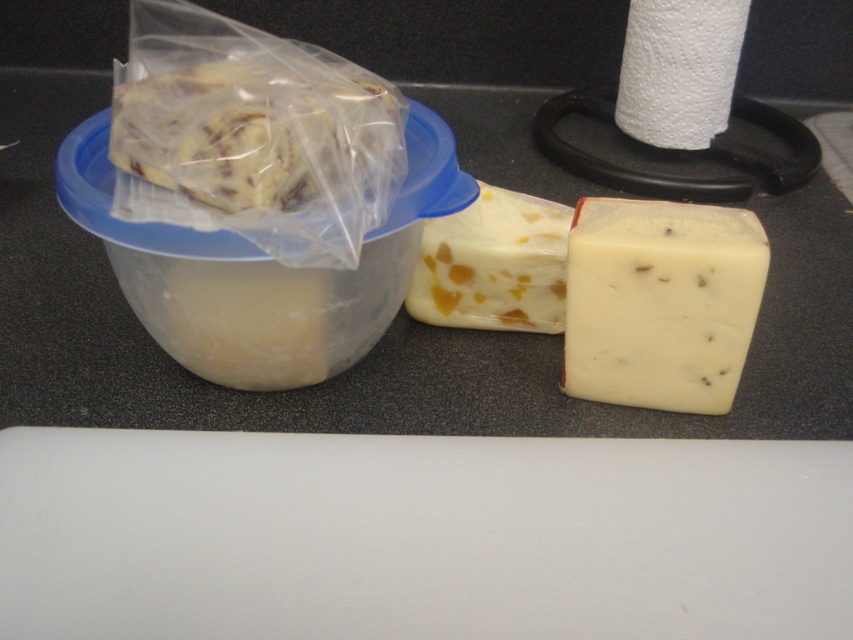
Where is `yellow crumbly cheese at center`? yellow crumbly cheese at center is located at coordinates (492, 264).

Is yellow crumbly cheese at center taller than white textured paper towel at upper right?

No.

Does point (426, 230) come behind point (717, 22)?

No, (426, 230) is closer to viewer.

The height and width of the screenshot is (640, 853). I want to click on yellow crumbly cheese at center, so click(492, 264).

Between translucent plastic bagged food at left and white textured paper towel at upper right, which one has more height?

white textured paper towel at upper right

Does translucent plastic bagged food at left have a lesser width compared to white textured paper towel at upper right?

No.

Does point (148, 154) come farther from viewer compared to point (700, 49)?

No, it is not.

You are a GUI agent. You are given a task and a screenshot of the screen. Output one action in this format:
    pyautogui.click(x=<x>, y=<y>)
    Task: Click on the translucent plastic bagged food at left
    
    Given the screenshot: What is the action you would take?
    pyautogui.click(x=248, y=131)

Is point (740, 264) closer to viewer compared to point (219, 173)?

No, it is not.

Which is behind, point (592, 227) or point (258, 145)?

The point (592, 227) is behind.

This screenshot has width=853, height=640. Find the location of `white creamy cheese at center`. white creamy cheese at center is located at coordinates (660, 301).